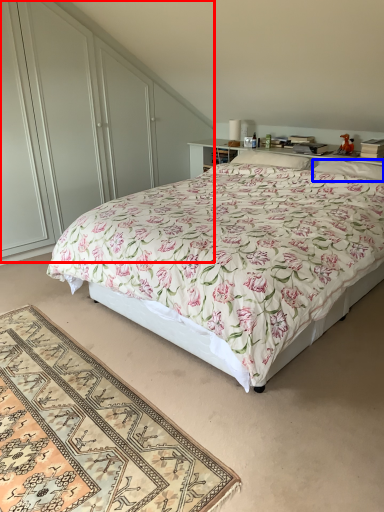
Question: Which object appears closest to the camera in this image, dresser (highlighted by a red box) or pillow (highlighted by a blue box)?

Choices:
 (A) dresser
 (B) pillow

Answer: (A)